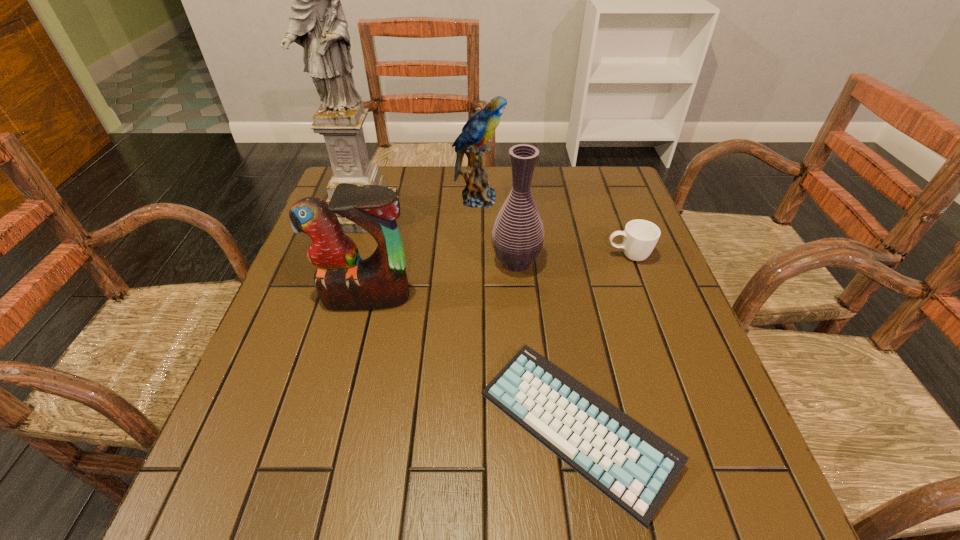
At what (x,y) coordinates should I click in order to perform the action: click on parrot located at the left edge. Please return your answer as a coordinate pair (x, y). This screenshot has height=540, width=960. Looking at the image, I should click on (344, 281).

Locate an element on the screen. This screenshot has width=960, height=540. cup at the right edge is located at coordinates (640, 236).

I want to click on computer keyboard at the right edge, so click(x=632, y=466).

Locate an element on the screen. object positioned at the far left corner is located at coordinates (x=317, y=23).

Image resolution: width=960 pixels, height=540 pixels. Identify the location of object that is at the near right corner. (632, 466).

I want to click on free space at the far edge, so 423,176.

Find the location of a particular element. The width and height of the screenshot is (960, 540). vacant space at the near edge is located at coordinates (596, 494).

Image resolution: width=960 pixels, height=540 pixels. I want to click on vacant space at the left edge of the desktop, so click(301, 284).

Locate an element on the screen. blank space at the right edge of the desktop is located at coordinates (611, 229).

The height and width of the screenshot is (540, 960). Find the location of `vacant space at the near left corner of the desktop`. vacant space at the near left corner of the desktop is located at coordinates (263, 517).